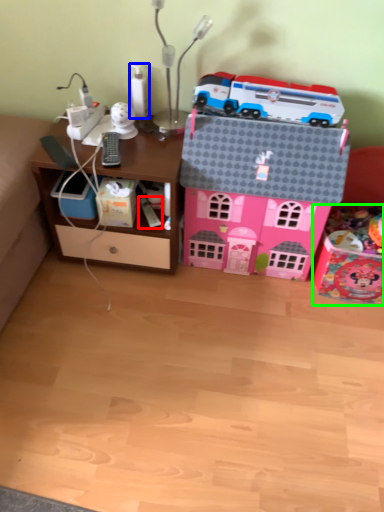
Question: Which is nearer to the toy (highlighted by a red box)? toy (highlighted by a blue box) or toy (highlighted by a green box).

Choices:
 (A) toy
 (B) toy

Answer: (A)